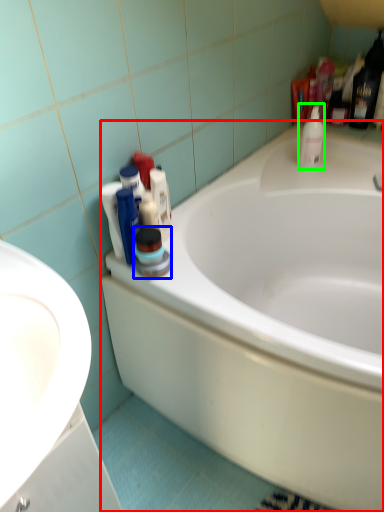
Question: Which object is positioned farthest from bathtub (highlighted by a red box)? Select from cleaning product (highlighted by a blue box) and cleaning product (highlighted by a green box).

Choices:
 (A) cleaning product
 (B) cleaning product

Answer: (B)